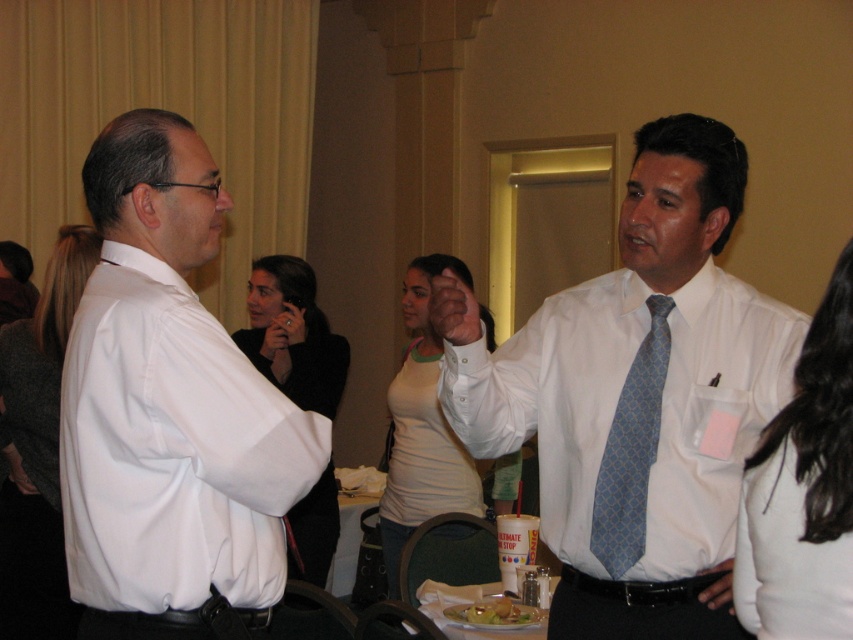
How much distance is there between white shirt at left and white fabric shirt at right?

white shirt at left is 94.38 centimeters from white fabric shirt at right.

Is white shirt at left thinner than white fabric shirt at right?

Incorrect, white shirt at left's width is not less than white fabric shirt at right's.

Between point (180, 492) and point (753, 509), which one is positioned in front?

Point (753, 509)

The height and width of the screenshot is (640, 853). Identify the location of white shirt at left. (171, 412).

Is point (646, 310) farther from viewer compared to point (28, 438)?

No, (646, 310) is closer to viewer.

Based on the photo, does white shirt with blue tie at center appear on the left side of dark gray sweater at center?

Incorrect, white shirt with blue tie at center is not on the left side of dark gray sweater at center.

Is point (643, 497) positioned in front of point (50, 621)?

Yes, point (643, 497) is in front of point (50, 621).

Image resolution: width=853 pixels, height=640 pixels. I want to click on white shirt with blue tie at center, so click(x=636, y=397).

Who is more forward, (45, 486) or (302, 266)?

Point (45, 486) is more forward.

Which is above, dark gray sweater at center or black fabric shirt at center?

black fabric shirt at center is above.

This screenshot has width=853, height=640. Identify the location of dark gray sweater at center. (38, 449).

This screenshot has width=853, height=640. Find the location of `dark gray sweater at center`. dark gray sweater at center is located at coordinates (38, 449).